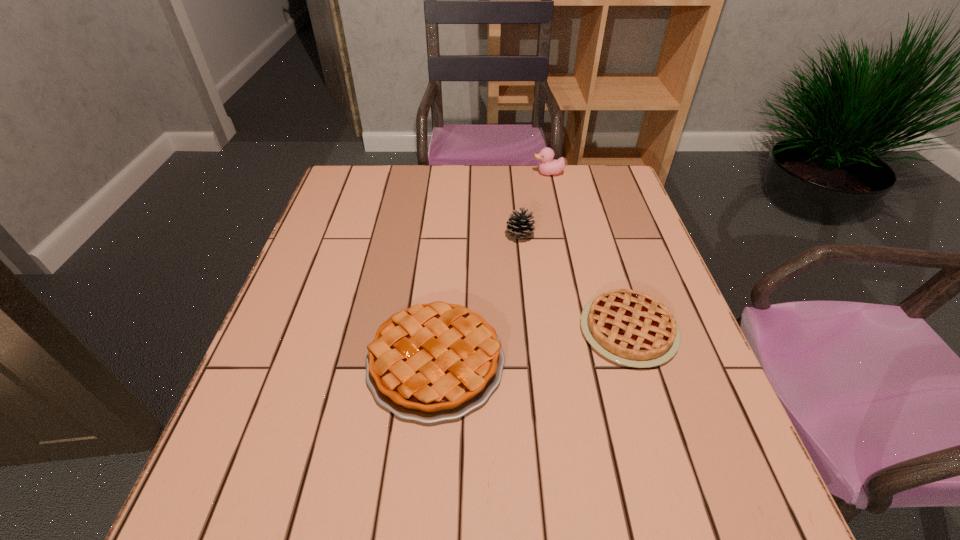
At what (x,y) coordinates should I click in order to perform the action: click on duckling. Please return your answer as a coordinate pair (x, y). The width and height of the screenshot is (960, 540). Looking at the image, I should click on (547, 166).

Find the location of `the second farthest object`. the second farthest object is located at coordinates (518, 225).

Locate an element on the screen. Image resolution: width=960 pixels, height=540 pixels. pinecone is located at coordinates (518, 225).

Image resolution: width=960 pixels, height=540 pixels. Identify the location of the taller pie. (432, 362).

In order to click on the leftmost object in this screenshot , I will do `click(432, 362)`.

The image size is (960, 540). In order to click on the shortest object in this screenshot , I will do `click(631, 328)`.

Locate an element on the screen. This screenshot has width=960, height=540. the right pie is located at coordinates (631, 328).

This screenshot has height=540, width=960. I want to click on vacant region located on the front-facing side of the farthest object, so click(448, 173).

Identify the location of vacant area located on the front-facing side of the farthest object. The width and height of the screenshot is (960, 540). (505, 173).

At what (x,y) coordinates should I click in order to perform the action: click on free location located on the front-facing side of the farthest object. Please return your answer as a coordinate pair (x, y). Looking at the image, I should click on (517, 173).